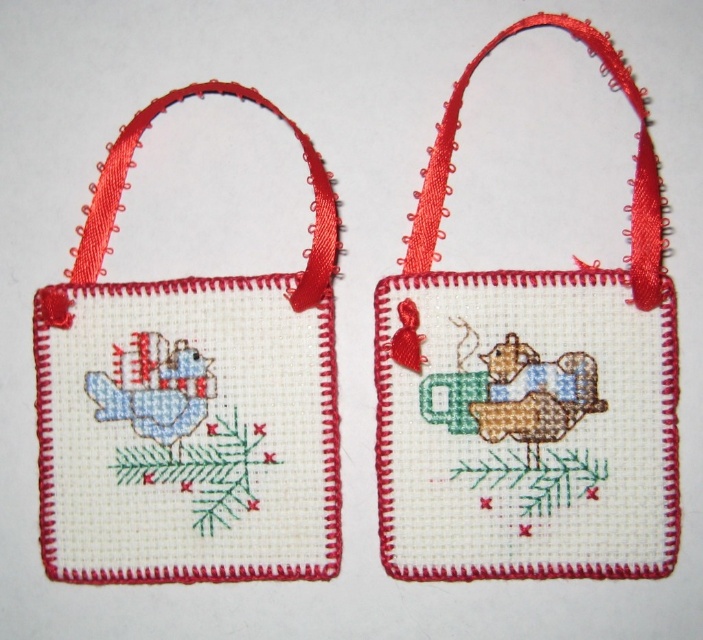
Is cross-stitched ornament at center taller than white cross-stitch fabric at upper left?

Correct, cross-stitched ornament at center is much taller as white cross-stitch fabric at upper left.

Does cross-stitched ornament at center appear on the right side of white cross-stitch fabric at upper left?

Yes, cross-stitched ornament at center is to the right of white cross-stitch fabric at upper left.

Identify the location of cross-stitched ornament at center. (529, 392).